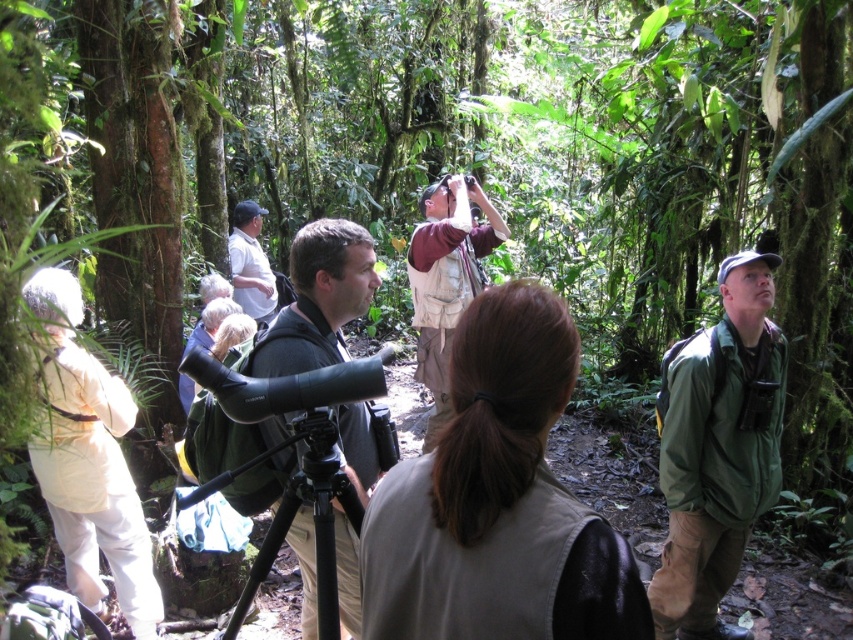
Between point (491, 484) and point (363, 488), which one is positioned behind?

The point (363, 488) is more distant.

Measure the distance between point (529, 500) and camera.

The distance of point (529, 500) from camera is 3.49 feet.

You are a GUI agent. You are given a task and a screenshot of the screen. Output one action in this format:
    pyautogui.click(x=<x>, y=<y>)
    Task: Click on the brown fabric vest at center
    The width and height of the screenshot is (853, 640).
    Given the screenshot: What is the action you would take?
    pyautogui.click(x=497, y=500)

At what (x,y) coordinates should I click in order to perform the action: click on maroon fabric binoculars at center. Please return your answer as a coordinate pair (x, y). The height and width of the screenshot is (640, 853). Looking at the image, I should click on (445, 280).

Where is `maroon fabric binoculars at center`? Image resolution: width=853 pixels, height=640 pixels. maroon fabric binoculars at center is located at coordinates (445, 280).

How much distance is there between green fabric jacket at center and white shirt at center?

They are 15.30 feet apart.

Does point (780, 422) come closer to viewer compared to point (252, 289)?

Yes, it is in front of point (252, 289).

Which is behind, point (737, 560) or point (260, 298)?

The point (260, 298) is behind.

The image size is (853, 640). I want to click on green fabric jacket at center, so click(717, 449).